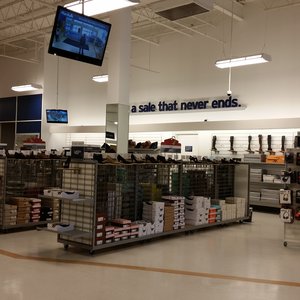
I want to click on cream colored shoe boxes, so point(240,202), point(240,210), point(231,209), point(228,216), point(225,215), point(222,206).